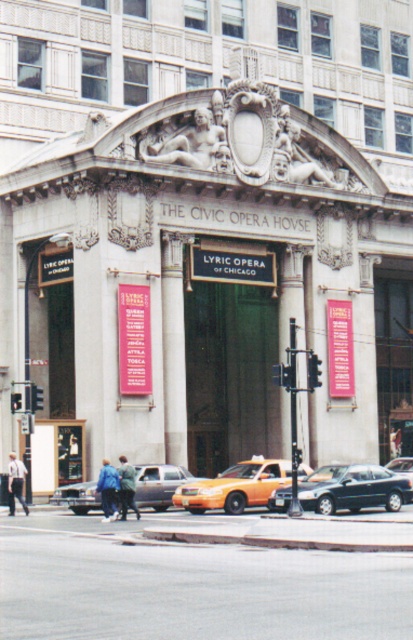
Based on the photo, who is taller, marble statue at center or green fabric jacket at lower center?

Standing taller between the two is marble statue at center.

Does marble statue at center appear on the right side of green fabric jacket at lower center?

Indeed, marble statue at center is positioned on the right side of green fabric jacket at lower center.

Identify the location of marble statue at center. (194, 145).

The height and width of the screenshot is (640, 413). I want to click on marble statue at center, so click(x=194, y=145).

Is the position of green fabric jacket at lower center less distant than that of metallic green sedan at center?

Yes, green fabric jacket at lower center is closer to the viewer.

Is point (135, 504) positioned behind point (408, 467)?

No.

Between point (121, 464) and point (405, 467), which one is positioned behind?

The point (405, 467) is more distant.

Locate an element on the screen. green fabric jacket at lower center is located at coordinates (127, 486).

Who is more distant from viewer, (102, 499) or (410, 461)?

The point (410, 461) is more distant.

Is blue denim jacket at lower left positioned before metallic green sedan at center?

Yes, blue denim jacket at lower left is closer to the viewer.

What do you see at coordinates (108, 490) in the screenshot?
I see `blue denim jacket at lower left` at bounding box center [108, 490].

What are the coordinates of `blue denim jacket at lower left` in the screenshot? It's located at (108, 490).